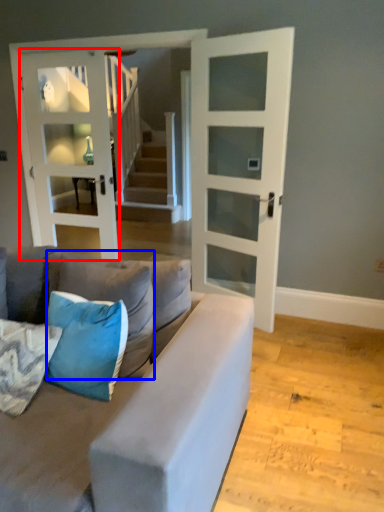
Question: Which of the following is the farthest to the observer, door (highlighted by a red box) or pillow (highlighted by a blue box)?

Choices:
 (A) door
 (B) pillow

Answer: (A)